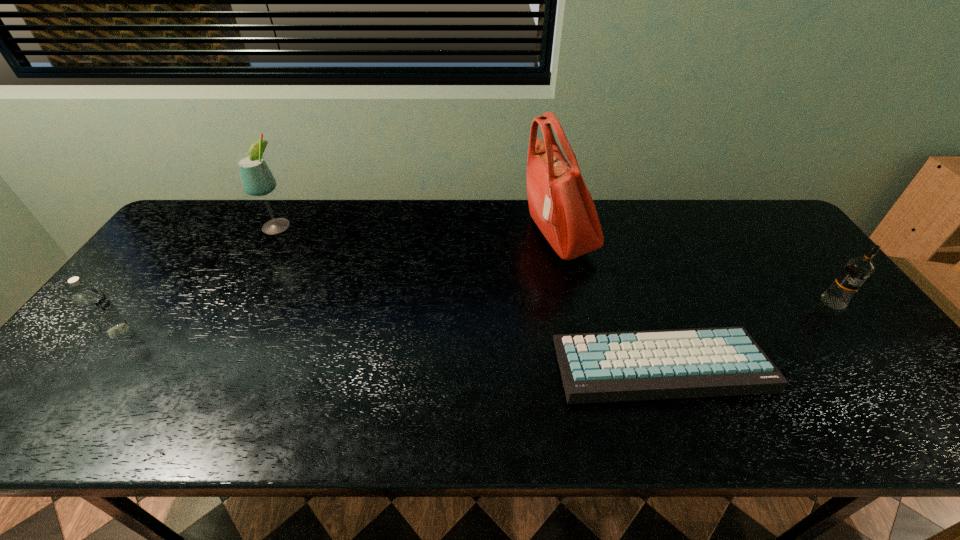
Find the location of a particular element. free space at the far edge is located at coordinates (364, 227).

Locate an element on the screen. This screenshot has height=540, width=960. vacant point at the near edge is located at coordinates (368, 418).

The image size is (960, 540). I want to click on vacant point at the left edge, so click(x=92, y=346).

This screenshot has width=960, height=540. I want to click on free spot at the right edge of the desktop, so click(x=845, y=368).

At what (x,y) coordinates should I click in order to perform the action: click on unoccupied position between the rightmost object and the nearer vodka. Please return your answer as a coordinate pair (x, y). Looking at the image, I should click on (475, 317).

Where is `vacant region between the nearer vodka and the fourth object from right to left`? This screenshot has height=540, width=960. vacant region between the nearer vodka and the fourth object from right to left is located at coordinates point(198,278).

In order to click on unoccupied area between the fourth shortest object and the computer keyboard in this screenshot , I will do `click(468, 295)`.

Find the location of a particular element. unoccupied position between the shortest object and the fourth shortest object is located at coordinates (468, 295).

I want to click on empty space between the alcohol and the nearer vodka, so click(198, 278).

Identify the location of blank region between the handbag and the second object from left to right. This screenshot has height=540, width=960. (418, 231).